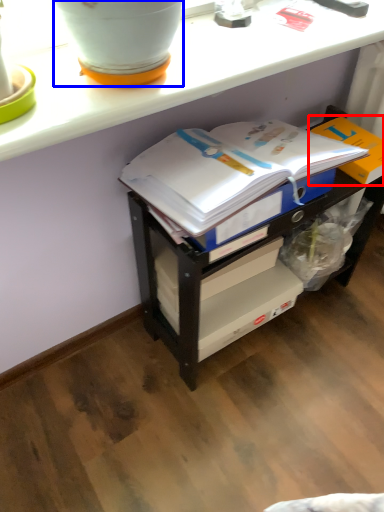
Question: Which object appears farthest to the camera in this image, cardboard box (highlighted by a red box) or flowerpot (highlighted by a blue box)?

Choices:
 (A) cardboard box
 (B) flowerpot

Answer: (A)